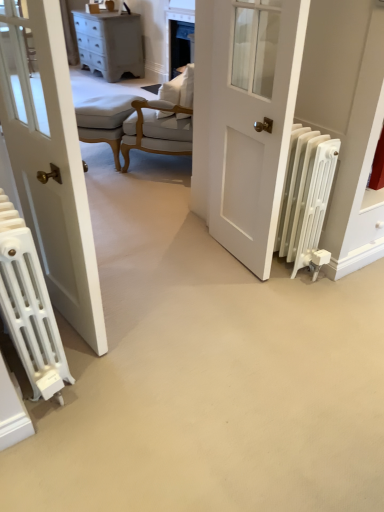
Locate an element on the screen. Image resolution: width=384 pixels, height=512 pixels. free location in front of white matte door at center is located at coordinates (231, 297).